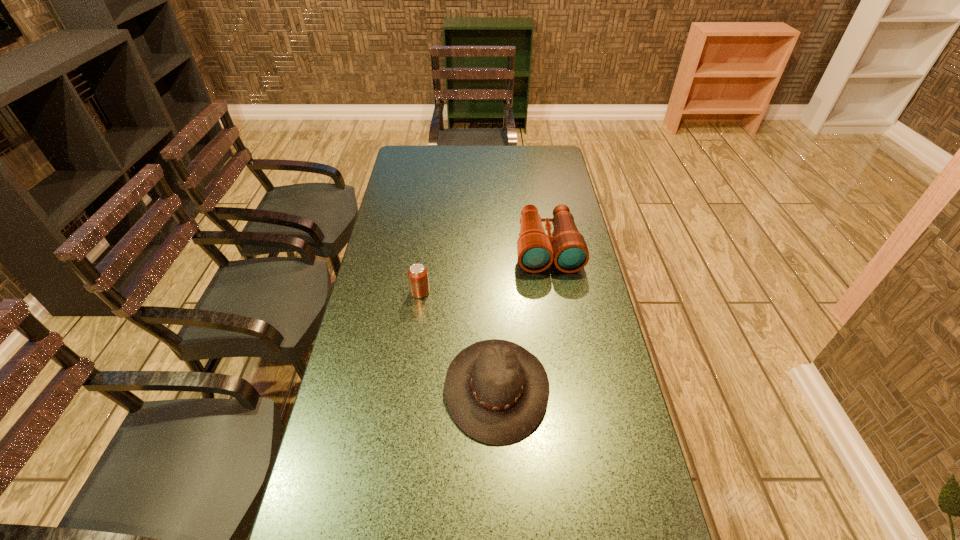
This screenshot has height=540, width=960. Find the location of `object that is at the right edge`. object that is at the right edge is located at coordinates (536, 250).

In the image, there is a desktop. Where is `vacant space at the far edge`? vacant space at the far edge is located at coordinates (485, 161).

The image size is (960, 540). In the image, there is a desktop. In order to click on free space at the left edge in this screenshot , I will do `click(345, 388)`.

The width and height of the screenshot is (960, 540). In order to click on vacant space at the right edge in this screenshot , I will do `click(556, 320)`.

In order to click on free space between the binoculars and the second nearest object in this screenshot , I will do `click(484, 270)`.

I want to click on vacant area between the can and the hat, so click(459, 340).

At what (x,y) coordinates should I click in order to perform the action: click on vacant area that lies between the hat and the binoculars. Please return your answer as a coordinate pair (x, y). This screenshot has width=960, height=540. Looking at the image, I should click on (522, 318).

You are a GUI agent. You are given a task and a screenshot of the screen. Output one action in this format:
    pyautogui.click(x=<x>, y=<y>)
    Task: Click on the blank region between the hat and the binoculars
    The image size is (960, 540).
    Given the screenshot: What is the action you would take?
    pyautogui.click(x=522, y=318)

Identify which object is located as the nearest to the nearest object. Please provide its 2D coordinates. Your answer should be formatted as a tuple, i.e. [(x, y)], where the tuple contains the x and y coordinates of a point satisfying the conditions above.

[(418, 279)]

Point out which object is positioned as the nearest to the nearest object. Please provide its 2D coordinates. Your answer should be formatted as a tuple, i.e. [(x, y)], where the tuple contains the x and y coordinates of a point satisfying the conditions above.

[(418, 279)]